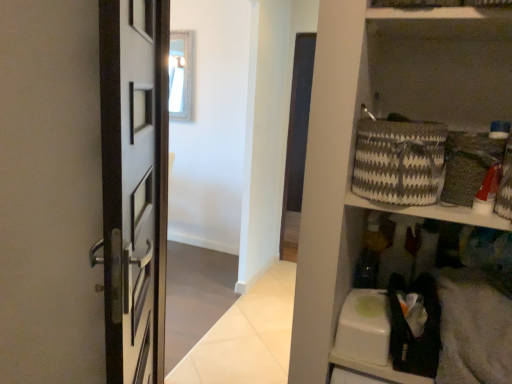
Question: Is gray and white woven basket at upper right bigger than wooden frame mirror at upper center?

Choices:
 (A) no
 (B) yes

Answer: (A)

Question: From the image's perspective, is gray and white woven basket at upper right below wooden frame mirror at upper center?

Choices:
 (A) no
 (B) yes

Answer: (B)

Question: Could wooden frame mirror at upper center be considered to be inside gray and white woven basket at upper right?

Choices:
 (A) yes
 (B) no

Answer: (B)

Question: Can we say gray and white woven basket at upper right lies outside wooden frame mirror at upper center?

Choices:
 (A) yes
 (B) no

Answer: (A)

Question: Is gray and white woven basket at upper right further to camera compared to wooden frame mirror at upper center?

Choices:
 (A) no
 (B) yes

Answer: (A)

Question: Choose the correct answer: Is gray and white woven basket at upper right inside wooden frame mirror at upper center or outside it?

Choices:
 (A) inside
 (B) outside

Answer: (B)

Question: From the image's perspective, relative to wooden frame mirror at upper center, is gray and white woven basket at upper right above or below?

Choices:
 (A) above
 (B) below

Answer: (B)

Question: Relative to wooden frame mirror at upper center, is gray and white woven basket at upper right in front or behind?

Choices:
 (A) front
 (B) behind

Answer: (A)

Question: Is gray and white woven basket at upper right taller or shorter than wooden frame mirror at upper center?

Choices:
 (A) tall
 (B) short

Answer: (B)

Question: Is gray and white woven basket at upper right wider or thinner than white glossy wall at upper center?

Choices:
 (A) thin
 (B) wide

Answer: (B)

Question: Based on their sizes in the image, would you say gray and white woven basket at upper right is bigger or smaller than white glossy wall at upper center?

Choices:
 (A) small
 (B) big

Answer: (A)

Question: Is gray and white woven basket at upper right situated inside white glossy wall at upper center or outside?

Choices:
 (A) inside
 (B) outside

Answer: (B)

Question: Is gray and white woven basket at upper right in front of or behind white glossy wall at upper center in the image?

Choices:
 (A) behind
 (B) front

Answer: (B)

Question: From the image's perspective, relative to wooden frame mirror at upper center, is white glossy wall at upper center above or below?

Choices:
 (A) above
 (B) below

Answer: (B)

Question: Considering the positions of point (282, 119) and point (185, 74), is point (282, 119) closer or farther from the camera than point (185, 74)?

Choices:
 (A) farther
 (B) closer

Answer: (B)